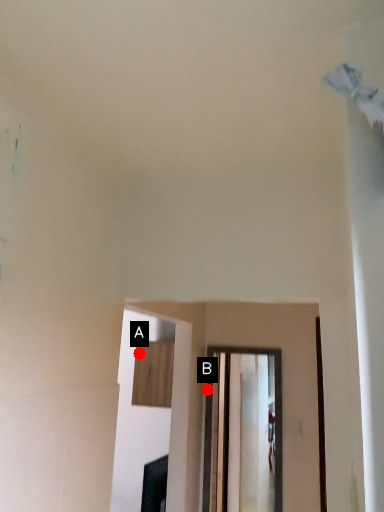
Question: Two points are circled on the image, labeled by A and B beside each circle. Which of the following is the farthest from the observer?

Choices:
 (A) A is further
 (B) B is further

Answer: (A)